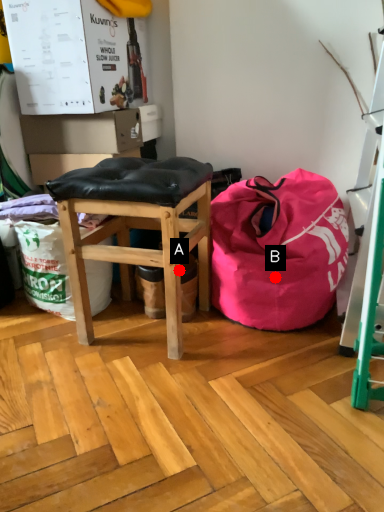
Question: Two points are circled on the image, labeled by A and B beside each circle. Which of the following is the closest to the observer?

Choices:
 (A) A is closer
 (B) B is closer

Answer: (A)